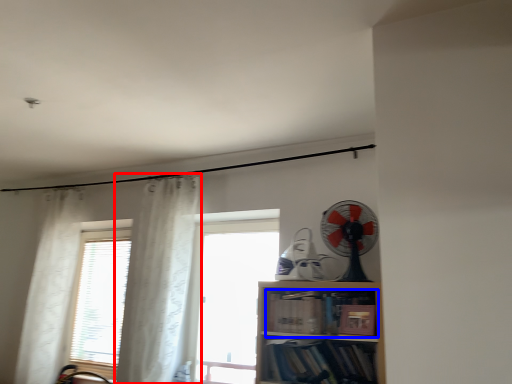
Question: Which point is closer to the camera, curtain (highlighted by a red box) or book (highlighted by a blue box)?

Choices:
 (A) curtain
 (B) book

Answer: (B)